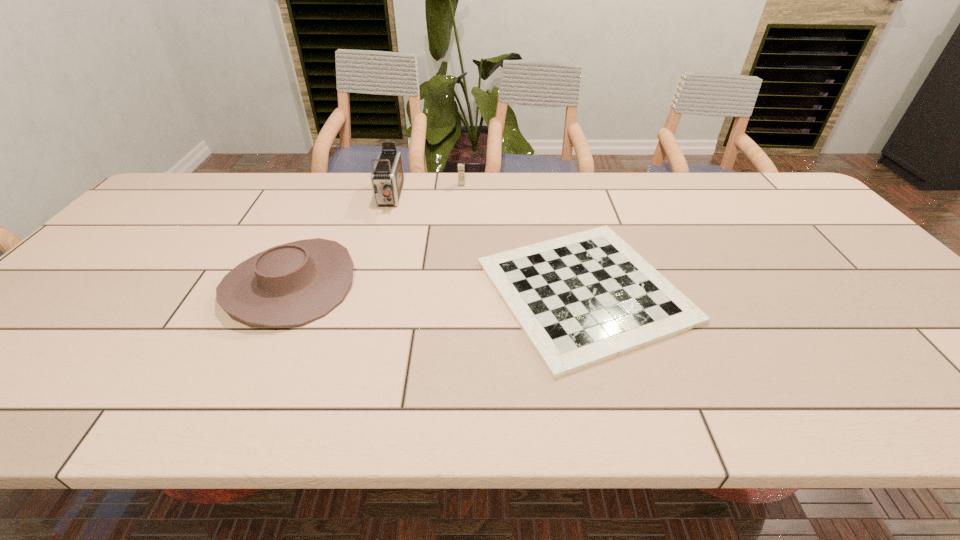
At what (x,y) coordinates should I click in order to perform the action: click on camcorder located in the far edge section of the desktop. Please return your answer as a coordinate pair (x, y). Looking at the image, I should click on (387, 177).

Locate an element on the screen. Image resolution: width=960 pixels, height=540 pixels. cellular telephone located in the far edge section of the desktop is located at coordinates (461, 172).

In the image, there is a desktop. Identify the location of free space at the far edge. The width and height of the screenshot is (960, 540). (480, 187).

What are the coordinates of `free location at the near edge of the desktop` in the screenshot? It's located at click(900, 380).

What are the coordinates of `vacant space at the right edge of the desktop` in the screenshot? It's located at (816, 270).

The height and width of the screenshot is (540, 960). In order to click on vacant space in between the third tallest object and the shortest object in this screenshot , I will do point(438,288).

Locate an element on the screen. The image size is (960, 540). vacant area between the tallest object and the checkerboard is located at coordinates (487, 244).

Identify the location of vacant space that is in between the second shortest object and the tallest object. (340, 240).

The width and height of the screenshot is (960, 540). I want to click on empty space that is in between the rightmost object and the cellular telephone, so click(523, 238).

The height and width of the screenshot is (540, 960). Identify the location of unoccupied position between the second shortest object and the rightmost object. (438, 288).